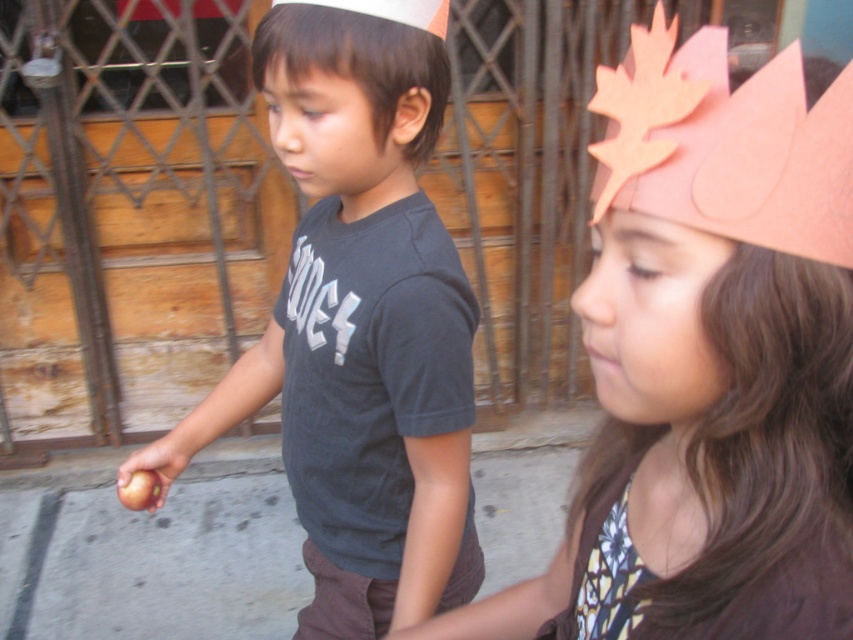
What is the color of the shirt at the location of point (363, 54)?

The point (363, 54) is on the matte black shirt at left, so the color is black.

You are a photographer trying to capture a closeup of the pink paper crown at upper right and the pink cardboard maple leaf at upper right. Since you can only focus on one object at a time, which one should you choose to ensure it fills the frame more?

The pink paper crown at upper right is bigger than the pink cardboard maple leaf at upper right, so you should focus on the pink paper crown at upper right to ensure it fills the frame more.

You are a photographer trying to capture both the matte black shirt at left and the pink cardboard maple leaf at upper right in a single frame. Based on their sizes in the image, which object should you focus on first to ensure both are in focus?

The matte black shirt at left is smaller than the pink cardboard maple leaf at upper right, so you should focus on the pink cardboard maple leaf at upper right first to ensure both are in focus.